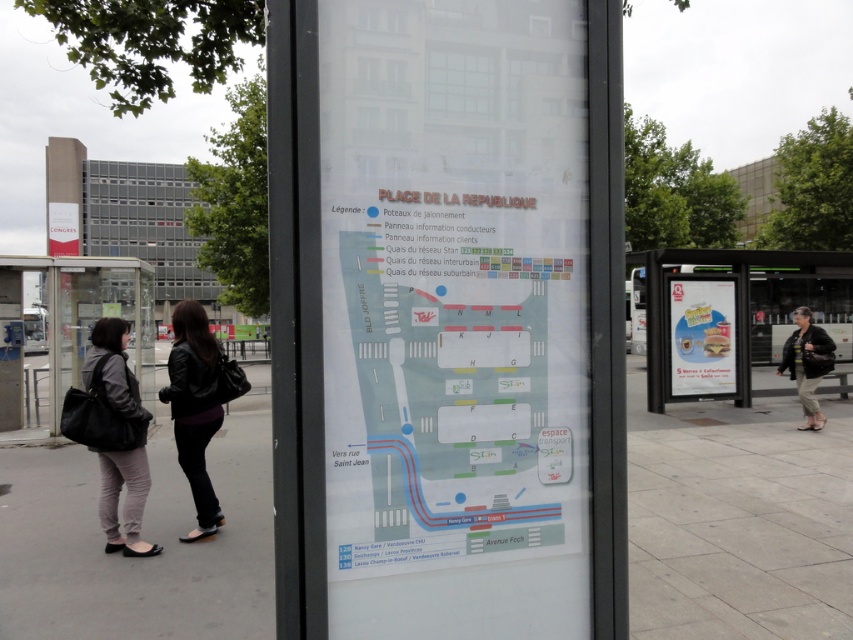
You are a delivery person carrying a heavy package and need to place it on the nearest bench. You are currently standing next to the gray leather jacket at lower left. Is the white plastic bench at right within a comfortable carrying distance for you?

The distance between the gray leather jacket at lower left and the white plastic bench at right is 11.14 meters. Since the bench is over 10 meters away, it might be too far to carry the package comfortably. Consider finding a closer bench or using a cart.

You are a traveler who needs to sit down. You see a white plastic bench at right and a gray leather jacket at lower left. Which object can you sit on?

The white plastic bench at right is a bench and can be sat on, while the gray leather jacket at lower left is clothing and cannot be sat on.